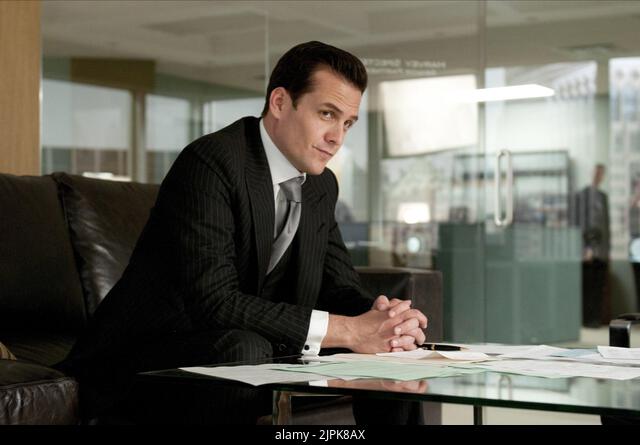
Find the location of a particular element. The height and width of the screenshot is (445, 640). glass table is located at coordinates (472, 381).